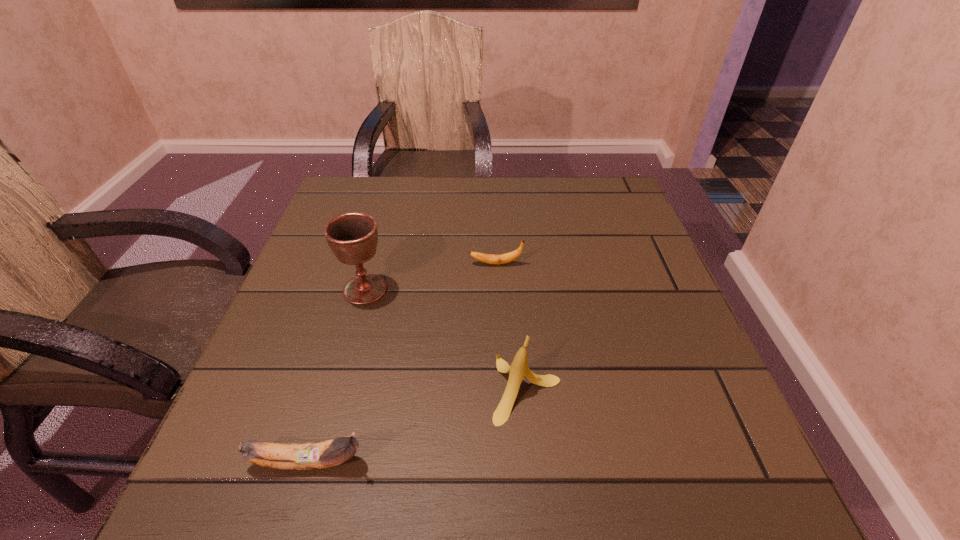
Locate an element on the screen. The width and height of the screenshot is (960, 540). chalice is located at coordinates (352, 237).

This screenshot has height=540, width=960. Identify the location of the tallest object. (352, 237).

Where is `the second nearest banana`? This screenshot has width=960, height=540. the second nearest banana is located at coordinates (519, 369).

This screenshot has height=540, width=960. Identify the location of the leftmost banana. (315, 455).

What are the coordinates of `the nearest object` in the screenshot? It's located at (315, 455).

This screenshot has height=540, width=960. I want to click on the farthest object, so click(505, 258).

Image resolution: width=960 pixels, height=540 pixels. Find the location of `the farthest banana`. the farthest banana is located at coordinates (505, 258).

Locate an element on the screen. Image resolution: width=960 pixels, height=540 pixels. free location located 0.370m on the front of the chalice is located at coordinates (307, 495).

The height and width of the screenshot is (540, 960). In order to click on vacant position located on the back of the third farthest object in this screenshot , I will do `click(517, 294)`.

At what (x,y) coordinates should I click in order to perform the action: click on vacant area located 0.280m at the stem of the nearest banana. Please return your answer as a coordinate pair (x, y). The image size is (960, 540). Looking at the image, I should click on (556, 462).